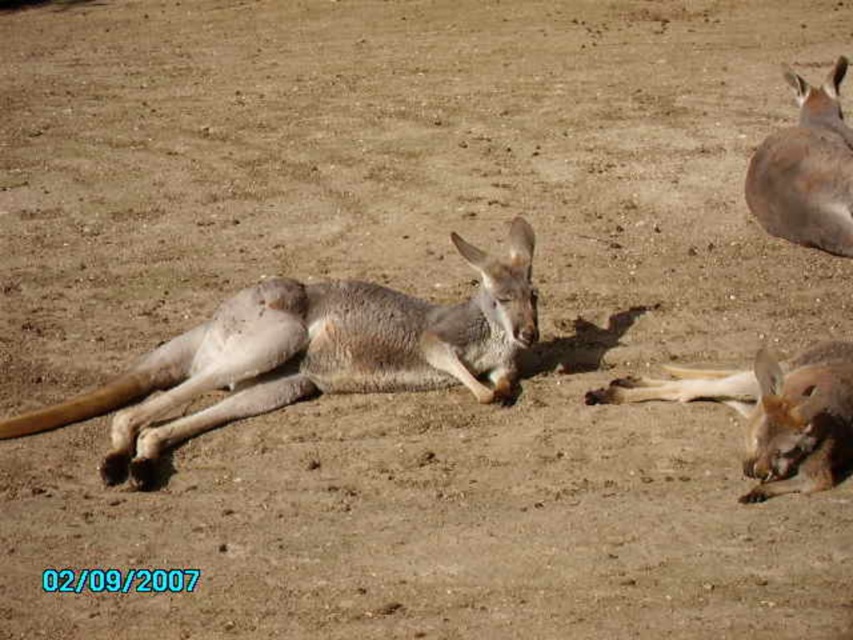
Is light brown fur kangaroo at center below light brown fur at upper right?

Correct, light brown fur kangaroo at center is located below light brown fur at upper right.

Does light brown fur kangaroo at center have a lesser width compared to light brown fur at upper right?

No, light brown fur kangaroo at center is not thinner than light brown fur at upper right.

The height and width of the screenshot is (640, 853). I want to click on light brown fur kangaroo at center, so click(x=311, y=355).

Locate an element on the screen. light brown fur kangaroo at center is located at coordinates (311, 355).

Does light brown fur kangaroo at center have a larger size compared to light brown fur at lower right?

Indeed, light brown fur kangaroo at center has a larger size compared to light brown fur at lower right.

Is light brown fur kangaroo at center above light brown fur at lower right?

Yes, light brown fur kangaroo at center is above light brown fur at lower right.

The width and height of the screenshot is (853, 640). Describe the element at coordinates (311, 355) in the screenshot. I see `light brown fur kangaroo at center` at that location.

This screenshot has height=640, width=853. Identify the location of light brown fur kangaroo at center. (311, 355).

In the scene shown: Is light brown fur at lower right thinner than light brown fur at upper right?

In fact, light brown fur at lower right might be wider than light brown fur at upper right.

Is light brown fur at lower right wider than light brown fur at upper right?

Correct, the width of light brown fur at lower right exceeds that of light brown fur at upper right.

At what (x,y) coordinates should I click in order to perform the action: click on light brown fur at lower right. Please return your answer as a coordinate pair (x, y). This screenshot has width=853, height=640. Looking at the image, I should click on (770, 413).

Where is `light brown fur at lower right`? This screenshot has height=640, width=853. light brown fur at lower right is located at coordinates (770, 413).